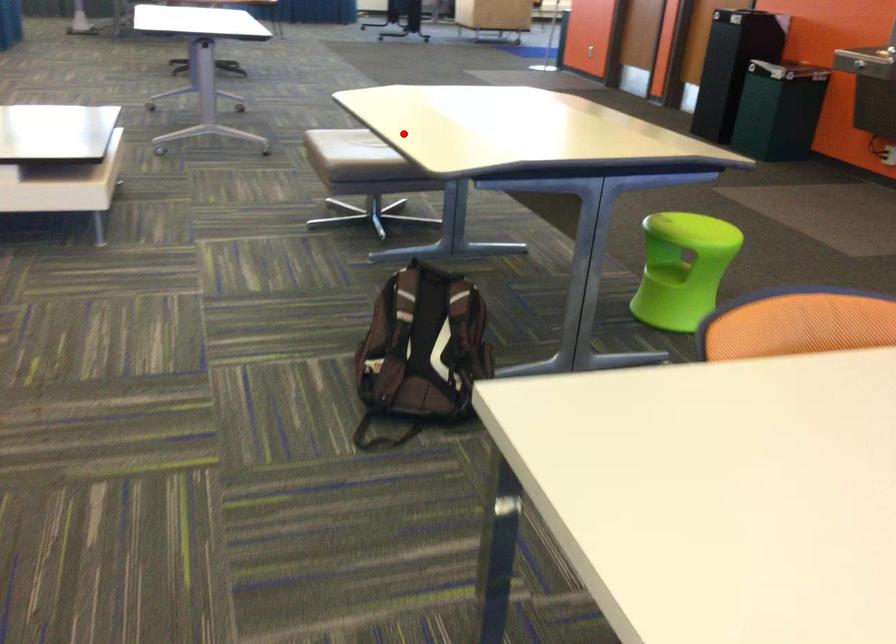
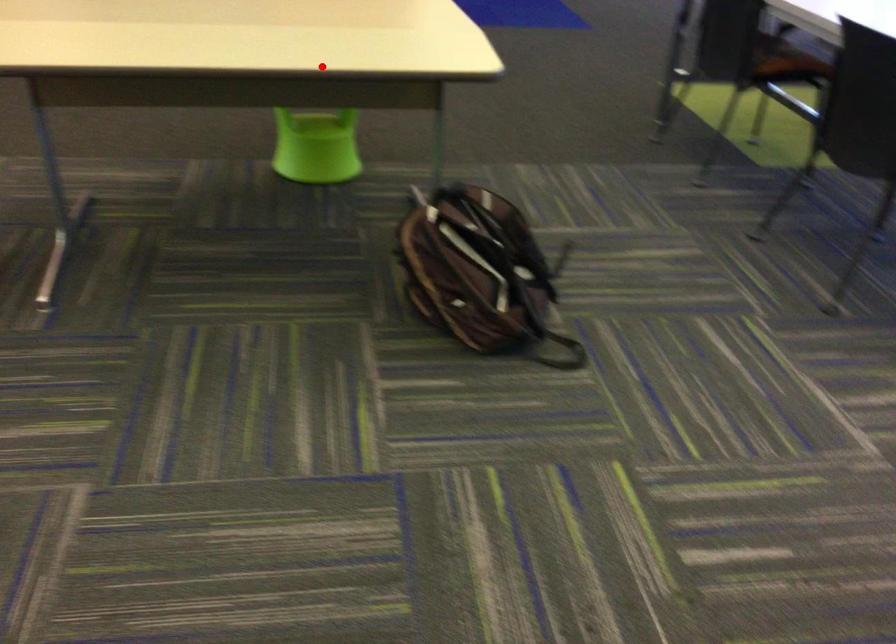
I am providing you with two images of the same scene from different viewpoints. A red point is marked on the first image and another point is marked on the second image. Is the marked point in image1 the same physical position as the marked point in image2?

Yes